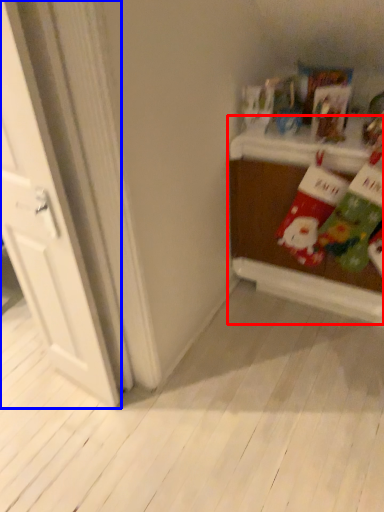
Question: Among these objects, which one is farthest to the camera, table (highlighted by a red box) or door (highlighted by a blue box)?

Choices:
 (A) table
 (B) door

Answer: (A)